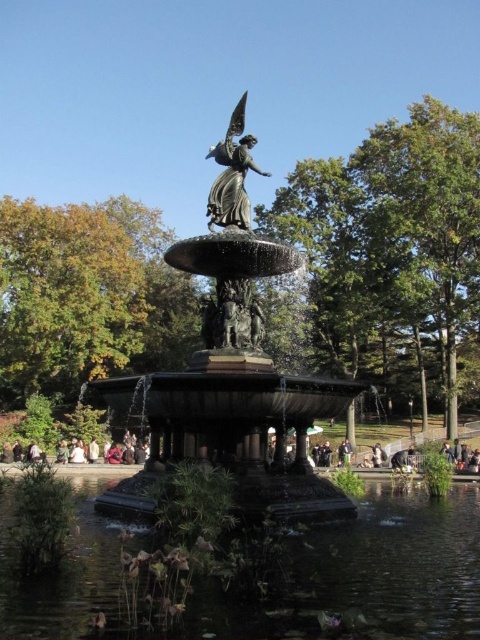
You are standing at the edge of the fountain and want to take a photo of the bronze statue at center. If your camera can only focus on objects within a 0.5 meter radius of the center point, will the statue be in focus?

The bronze statue at center is located at point (230, 374), which is within the 0.5 meter radius of the center point, so the statue will be in focus.

You are a photographer planning to capture the fountain from a specific angle. You want to ensure that the clear water at fountain center and the polished bronze statue at center are both visible in your shot. Considering their sizes, which one will occupy more space in the photo?

The clear water at fountain center will occupy more space in the photo because its width is larger than the polished bronze statue at center.